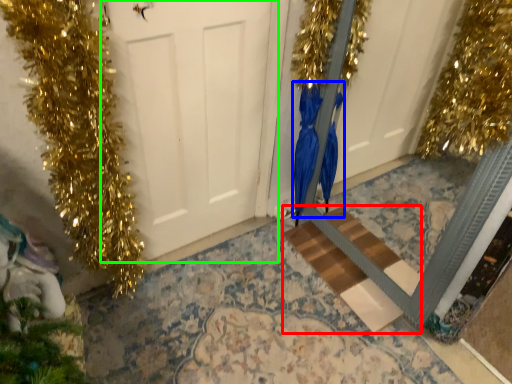
Question: Considering the real-world distances, which object is farthest from stairwell (highlighted by a red box)? dress (highlighted by a blue box) or door (highlighted by a green box)?

Choices:
 (A) dress
 (B) door

Answer: (B)